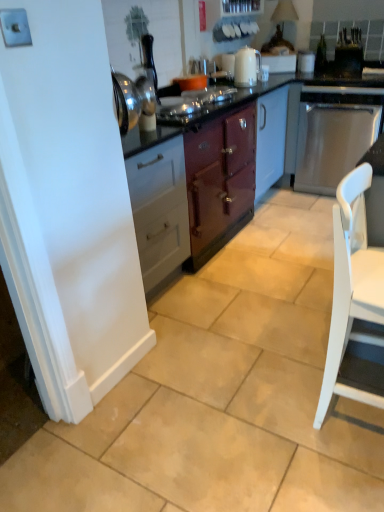
Find the location of a particular element. vacant region below white matte chair at lower right (from a real-world perspective) is located at coordinates (356, 418).